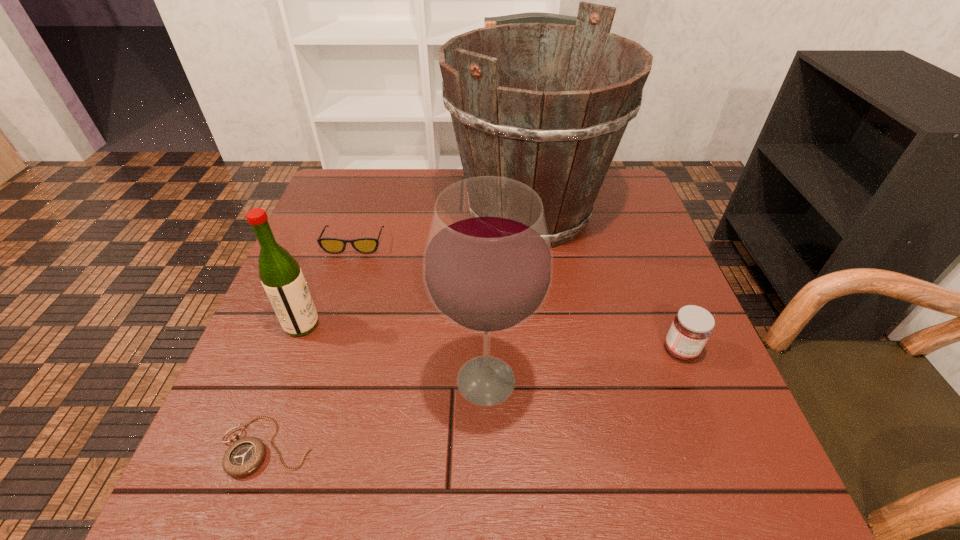
Identify which object is the fifth closest to the second tallest object. Please provide its 2D coordinates. Your answer should be formatted as a tuple, i.e. [(x, y)], where the tuple contains the x and y coordinates of a point satisfying the conditions above.

[(330, 245)]

The width and height of the screenshot is (960, 540). Identify the location of vacant space that satisfies the following two spatial constraints: 1. on the front-facing side of the fifth tallest object; 2. on the label of the third tallest object. (328, 325).

The width and height of the screenshot is (960, 540). What are the coordinates of `vacant space that satisfies the following two spatial constraints: 1. on the label of the third tallest object; 2. on the left side of the pocket watch` in the screenshot? It's located at tap(256, 446).

At what (x,y) coordinates should I click in order to perform the action: click on vacant position in the image that satisfies the following two spatial constraints: 1. on the front-facing side of the alcohol; 2. on the right side of the second shortest object. Please return your answer as a coordinate pair (x, y). The height and width of the screenshot is (540, 960). Looking at the image, I should click on (311, 381).

Find the location of a particular element. Image resolution: width=960 pixels, height=540 pixels. vacant space that satisfies the following two spatial constraints: 1. on the label of the liquor; 2. on the back side of the second tallest object is located at coordinates (280, 381).

In order to click on free region that satisfies the following two spatial constraints: 1. on the label of the liquor; 2. on the right side of the shortest object in this screenshot , I will do `click(256, 446)`.

Locate an element on the screen. The image size is (960, 540). vacant area in the image that satisfies the following two spatial constraints: 1. on the back side of the bucket; 2. on the left side of the second tallest object is located at coordinates (484, 212).

Identify the location of blank area in the image that satisfies the following two spatial constraints: 1. on the front-facing side of the alcohol; 2. on the left side of the second shortest object. (311, 381).

Where is `free space that satisfies the following two spatial constraints: 1. on the front side of the bucket; 2. on the right side of the rightmost object`? free space that satisfies the following two spatial constraints: 1. on the front side of the bucket; 2. on the right side of the rightmost object is located at coordinates (548, 350).